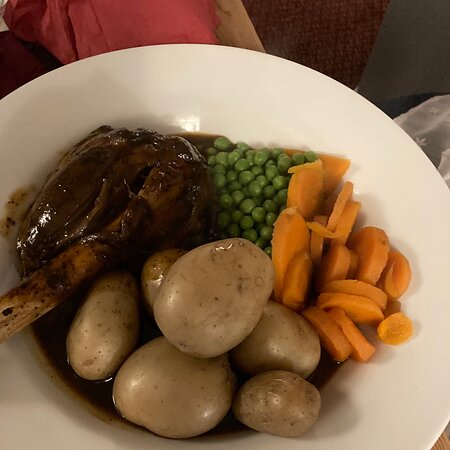
Locate an element on the screen. Image resolution: width=450 pixels, height=450 pixels. glass is located at coordinates [x=6, y=9].